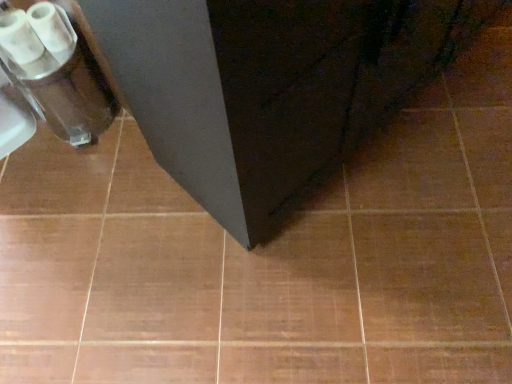
Question: From the image's perspective, is matte black cabinet at center beneath white glossy toilet paper at upper left?

Choices:
 (A) no
 (B) yes

Answer: (A)

Question: Can you confirm if matte black cabinet at center is positioned to the right of white glossy toilet paper at upper left?

Choices:
 (A) yes
 (B) no

Answer: (A)

Question: Are matte black cabinet at center and white glossy toilet paper at upper left beside each other?

Choices:
 (A) no
 (B) yes

Answer: (A)

Question: Considering the relative sizes of matte black cabinet at center and white glossy toilet paper at upper left in the image provided, is matte black cabinet at center thinner than white glossy toilet paper at upper left?

Choices:
 (A) no
 (B) yes

Answer: (A)

Question: Could white glossy toilet paper at upper left be considered to be inside matte black cabinet at center?

Choices:
 (A) yes
 (B) no

Answer: (B)

Question: Can you confirm if matte black cabinet at center is taller than white glossy toilet paper at upper left?

Choices:
 (A) no
 (B) yes

Answer: (B)

Question: Is white glossy toilet paper at upper left touching matte black cabinet at center?

Choices:
 (A) yes
 (B) no

Answer: (B)

Question: Considering the relative sizes of white glossy toilet paper at upper left and matte black cabinet at center in the image provided, is white glossy toilet paper at upper left wider than matte black cabinet at center?

Choices:
 (A) yes
 (B) no

Answer: (B)

Question: From the image's perspective, is white glossy toilet paper at upper left above matte black cabinet at center?

Choices:
 (A) yes
 (B) no

Answer: (B)

Question: Is white glossy toilet paper at upper left looking in the opposite direction of matte black cabinet at center?

Choices:
 (A) no
 (B) yes

Answer: (A)

Question: Is white glossy toilet paper at upper left far away from matte black cabinet at center?

Choices:
 (A) no
 (B) yes

Answer: (A)

Question: From a real-world perspective, is white glossy toilet paper at upper left physically above matte black cabinet at center?

Choices:
 (A) yes
 (B) no

Answer: (B)

Question: Is matte black cabinet at center to the left or to the right of white glossy toilet paper at upper left in the image?

Choices:
 (A) right
 (B) left

Answer: (A)